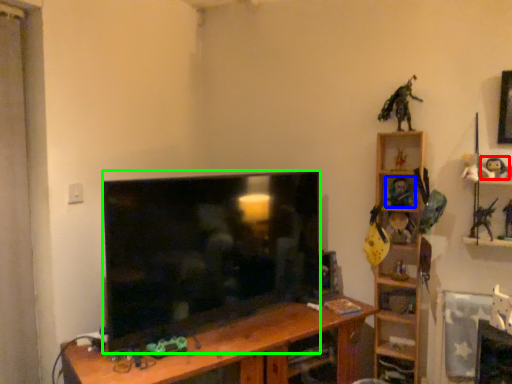
Question: Which is farther away from toy (highlighted by a red box)? toy (highlighted by a blue box) or television (highlighted by a green box)?

Choices:
 (A) toy
 (B) television

Answer: (B)